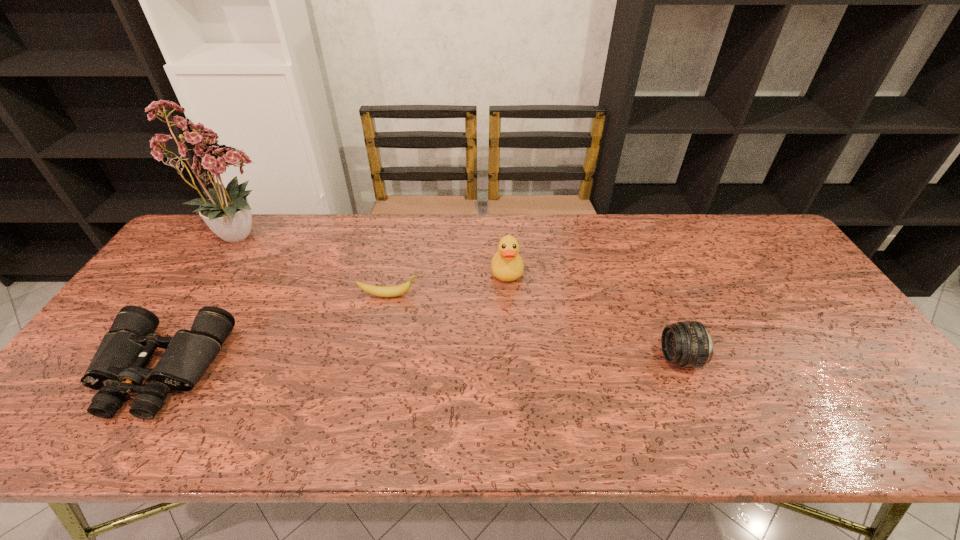
Locate an element on the screen. the farthest object is located at coordinates (227, 213).

Identify the location of the tallest object. This screenshot has width=960, height=540. (227, 213).

This screenshot has height=540, width=960. I want to click on the second tallest object, so click(x=507, y=265).

Find the location of a particular element. Image resolution: width=960 pixels, height=540 pixels. duck is located at coordinates (507, 265).

This screenshot has width=960, height=540. I want to click on the rightmost object, so click(686, 343).

You are a GUI agent. You are given a task and a screenshot of the screen. Output one action in this format:
    pyautogui.click(x=<x>, y=<y>)
    Task: Click on the binoculars
    The width and height of the screenshot is (960, 540).
    Given the screenshot: What is the action you would take?
    pyautogui.click(x=117, y=368)

The image size is (960, 540). Identify the location of the third nearest object. (381, 291).

Find the location of a particular element. banana is located at coordinates (381, 291).

You are a GUI agent. You are given a task and a screenshot of the screen. Output one action in this format:
    pyautogui.click(x=<x>, y=<y>)
    Task: Click on the free region located 0.290m on the front-facing side of the flower arrangement
    This screenshot has width=960, height=540.
    Given the screenshot: What is the action you would take?
    pyautogui.click(x=377, y=235)

Locate an element on the screen. blank space located 0.190m at the beak of the fourth nearest object is located at coordinates (511, 336).